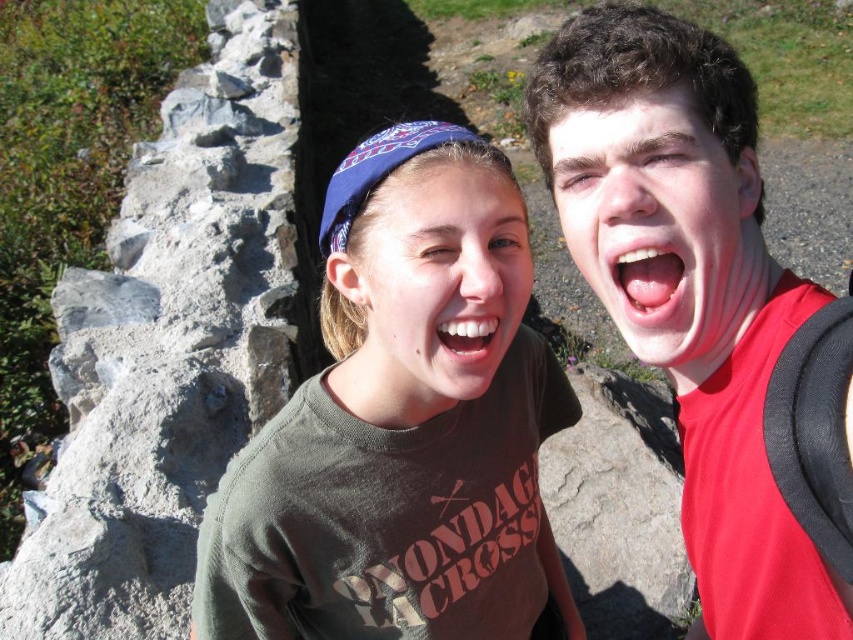
Question: Can you confirm if gray rough stone at left is positioned to the right of pink glossy lips at center?

Choices:
 (A) no
 (B) yes

Answer: (A)

Question: Which of the following is the farthest from the observer?

Choices:
 (A) pink glossy lips at center
 (B) matte skin face at center

Answer: (A)

Question: Which of the following is the closest to the observer?

Choices:
 (A) white glossy teeth at center
 (B) green matte t-shirt at center

Answer: (B)

Question: Observing the image, what is the correct spatial positioning of green matte t-shirt at center in reference to pink glossy lips at center?

Choices:
 (A) below
 (B) above

Answer: (A)

Question: Which of the following is the farthest from the observer?

Choices:
 (A) pink glossy lips at center
 (B) gray rough stone at left

Answer: (B)

Question: Is red matte shirt at right thinner than matte green t-shirt at center?

Choices:
 (A) yes
 (B) no

Answer: (B)